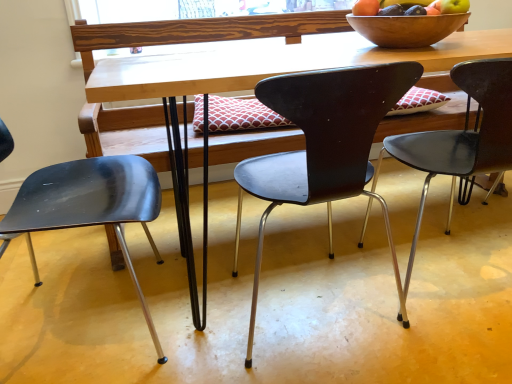
Question: Is wooden desk at center inside matte black chair at center, arranged as the 3th chair when viewed from the left?

Choices:
 (A) no
 (B) yes

Answer: (A)

Question: Is matte black chair at center, arranged as the 3th chair when viewed from the left, located outside wooden desk at center?

Choices:
 (A) yes
 (B) no

Answer: (B)

Question: From a real-world perspective, is matte black chair at center, arranged as the 3th chair when viewed from the left, under wooden desk at center?

Choices:
 (A) no
 (B) yes

Answer: (B)

Question: Considering the relative sizes of matte black chair at center, arranged as the 3th chair when viewed from the left, and wooden desk at center in the image provided, is matte black chair at center, arranged as the 3th chair when viewed from the left, smaller than wooden desk at center?

Choices:
 (A) yes
 (B) no

Answer: (A)

Question: Does matte black chair at center, arranged as the 3th chair when viewed from the left, have a lesser height compared to wooden desk at center?

Choices:
 (A) yes
 (B) no

Answer: (A)

Question: From a real-world perspective, is matte black chair at center, arranged as the first chair when viewed from the right, positioned over wooden desk at center based on gravity?

Choices:
 (A) no
 (B) yes

Answer: (A)

Question: Considering the relative sizes of wooden bowl at upper right and matte black chair at center, arranged as the first chair when viewed from the right, in the image provided, is wooden bowl at upper right thinner than matte black chair at center, arranged as the first chair when viewed from the right,?

Choices:
 (A) yes
 (B) no

Answer: (A)

Question: Is there a large distance between wooden bowl at upper right and matte black chair at center, arranged as the first chair when viewed from the right?

Choices:
 (A) no
 (B) yes

Answer: (A)

Question: From the image's perspective, would you say wooden bowl at upper right is shown under matte black chair at center, arranged as the first chair when viewed from the right?

Choices:
 (A) no
 (B) yes

Answer: (A)

Question: Is wooden bowl at upper right to the right of matte black chair at center, arranged as the 3th chair when viewed from the left, from the viewer's perspective?

Choices:
 (A) no
 (B) yes

Answer: (A)

Question: Is wooden bowl at upper right aimed at matte black chair at center, arranged as the 3th chair when viewed from the left?

Choices:
 (A) yes
 (B) no

Answer: (B)

Question: Considering the relative sizes of wooden bowl at upper right and matte black chair at center, arranged as the first chair when viewed from the right, in the image provided, is wooden bowl at upper right wider than matte black chair at center, arranged as the first chair when viewed from the right,?

Choices:
 (A) yes
 (B) no

Answer: (B)

Question: Is matte black chair at center, arranged as the first chair when viewed from the right, at the left side of matte black chair at center, marked as the 2th chair in a right-to-left arrangement?

Choices:
 (A) no
 (B) yes

Answer: (A)